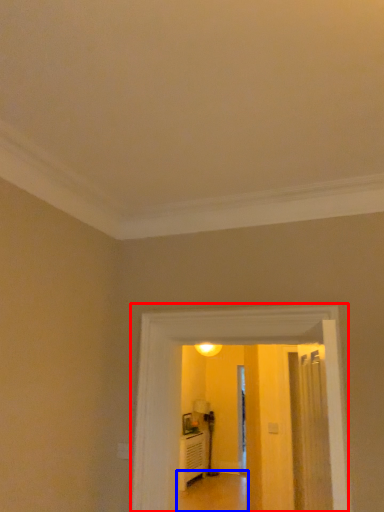
Question: Which point is further to the camera, corridor (highlighted by a red box) or path (highlighted by a blue box)?

Choices:
 (A) corridor
 (B) path

Answer: (B)